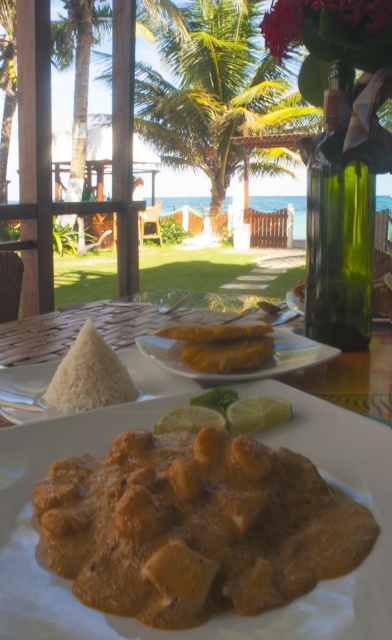
Question: Is white matte rice at center in front of yellow matte plate at center?

Choices:
 (A) no
 (B) yes

Answer: (B)

Question: Among these objects, which one is nearest to the camera?

Choices:
 (A) green glass bottle at right
 (B) yellow matte bread at center
 (C) white matte rice at center
 (D) smooth creamy curry at center

Answer: (D)

Question: Does green glass bottle at right appear over yellow matte plate at center?

Choices:
 (A) no
 (B) yes

Answer: (B)

Question: Which point appears closest to the camera in this image?

Choices:
 (A) (172, 364)
 (B) (245, 344)

Answer: (A)

Question: Observing the image, what is the correct spatial positioning of white matte rice at lower left in reference to white matte rice at center?

Choices:
 (A) left
 (B) right

Answer: (B)

Question: Which point is farther to the camera?

Choices:
 (A) white matte rice at center
 (B) white matte rice at lower left
 (C) smooth creamy curry at center

Answer: (A)